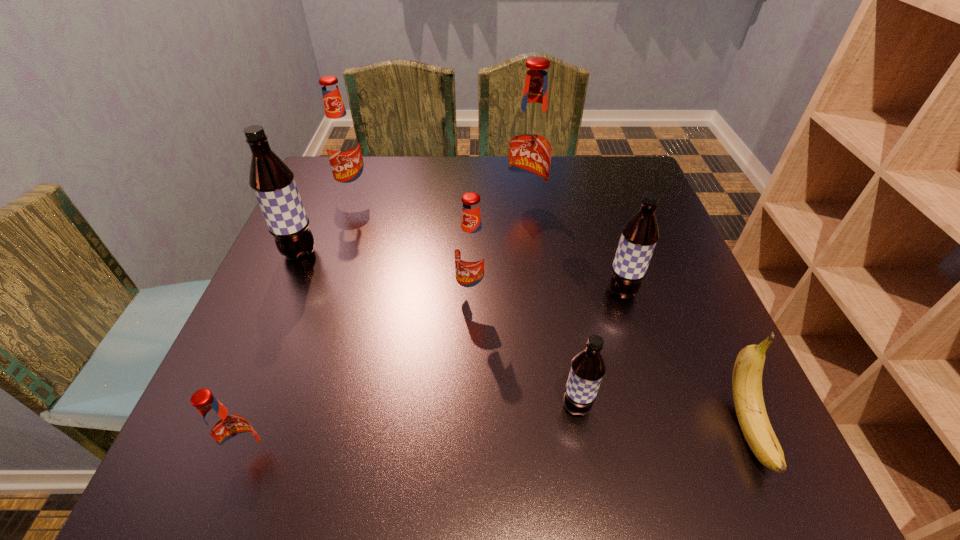
Where is `free space between the fifth nearest root beer and the tallest root beer`? The height and width of the screenshot is (540, 960). free space between the fifth nearest root beer and the tallest root beer is located at coordinates [413, 231].

What are the coordinates of `blank region between the tallest root beer and the smallest brown root beer` in the screenshot? It's located at (551, 307).

Locate an element on the screen. The width and height of the screenshot is (960, 540). unoccupied position between the biggest brown root beer and the third biggest red root beer is located at coordinates (386, 273).

Where is `vacant point located between the third smallest red root beer and the biggest red root beer`? This screenshot has width=960, height=540. vacant point located between the third smallest red root beer and the biggest red root beer is located at coordinates (440, 201).

Where is `unoccupied area between the second nearest root beer and the fourth root beer from left to right`? unoccupied area between the second nearest root beer and the fourth root beer from left to right is located at coordinates (524, 350).

The width and height of the screenshot is (960, 540). Identify the location of the sixth closest object to the smallest brown root beer. (272, 181).

Point out which object is positioned as the second nearest to the nearest root beer. Please provide its 2D coordinates. Your answer should be formatted as a tuple, i.e. [(x, y)], where the tuple contains the x and y coordinates of a point satisfying the conditions above.

[(272, 181)]

Where is `the fifth closest root beer relative to the tallest object`? The height and width of the screenshot is (540, 960). the fifth closest root beer relative to the tallest object is located at coordinates (587, 369).

Locate which root beer ranks sixth in proximity to the fifth object from right to left. Please provide its 2D coordinates. Your answer should be formatted as a tuple, i.e. [(x, y)], where the tuple contains the x and y coordinates of a point satisfying the conditions above.

[(230, 433)]

At what (x,y) coordinates should I click in order to perform the action: click on the second closest red root beer to the yellow banana. Please return your answer as a coordinate pair (x, y). This screenshot has width=960, height=540. Looking at the image, I should click on (530, 147).